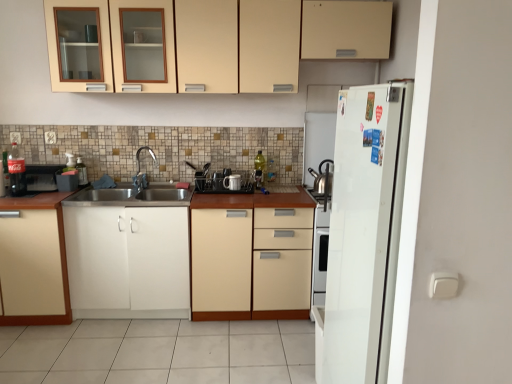
Question: Looking at the image, does translucent glass bottle at center, the 1th bottle positioned from the right, seem bigger or smaller compared to matte cream cabinet at upper center, the third cabinetry from the left?

Choices:
 (A) small
 (B) big

Answer: (A)

Question: Considering the positions of point (262, 180) and point (175, 29), is point (262, 180) closer or farther from the camera than point (175, 29)?

Choices:
 (A) closer
 (B) farther

Answer: (B)

Question: Which of these objects is positioned closest to the metallic spray bottle at left, the fourth appliance when ordered from right to left?

Choices:
 (A) white plastic electric outlet at lower left, the first electric outlet when ordered from left to right
 (B) brushed metal faucet at center
 (C) beige wood cabinet at center, the first cabinetry positioned from the right
 (D) matte black dish rack at center, marked as the third appliance in a right-to-left arrangement
 (E) white plastic electric outlet at upper left, the second electric outlet from the left

Answer: (E)

Question: Considering the real-world distances, which object is closest to the matte glass bottle at left, which is counted as the second bottle, starting from the back?

Choices:
 (A) white matte refrigerator at right
 (B) metallic spray bottle at left, the fourth appliance when ordered from right to left
 (C) white plastic electric outlet at upper left, which ranks as the first electric outlet in right-to-left order
 (D) white glossy kettle at right, acting as the first appliance starting from the right
 (E) matte white cabinet at lower left, the 1th cabinetry in the left-to-right sequence

Answer: (C)